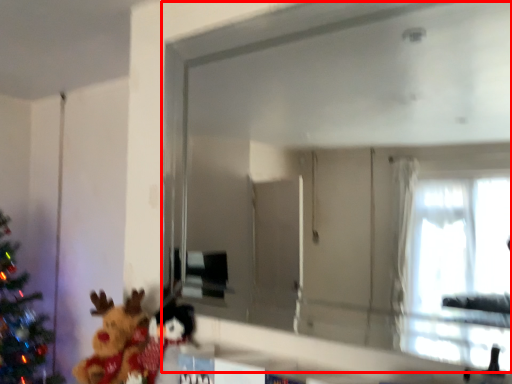
Question: From the image's perspective, where is mirror (annotated by the red box) located relative to toy?

Choices:
 (A) below
 (B) above

Answer: (B)